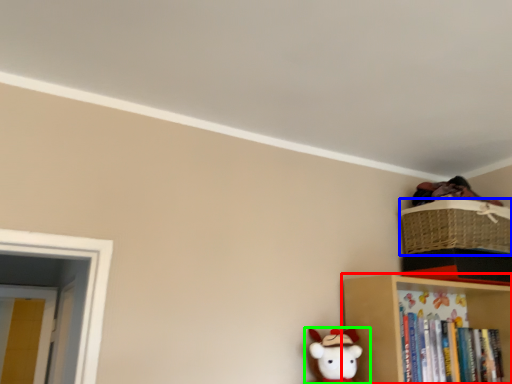
Question: Based on their relative distances, which object is farther from shelf (highlighted by a red box)? Choose from basket (highlighted by a blue box) and toy (highlighted by a green box).

Choices:
 (A) basket
 (B) toy

Answer: (A)